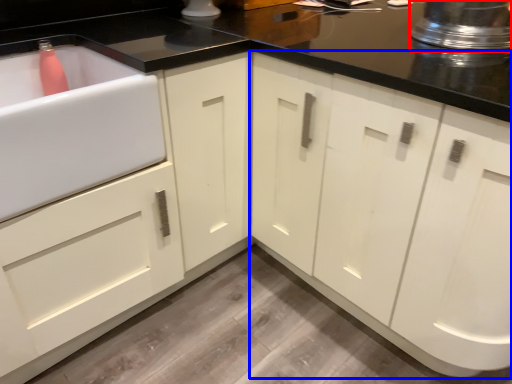
Question: Which object appears closest to the camera in this image, appliance (highlighted by a red box) or cabinetry (highlighted by a blue box)?

Choices:
 (A) appliance
 (B) cabinetry

Answer: (B)